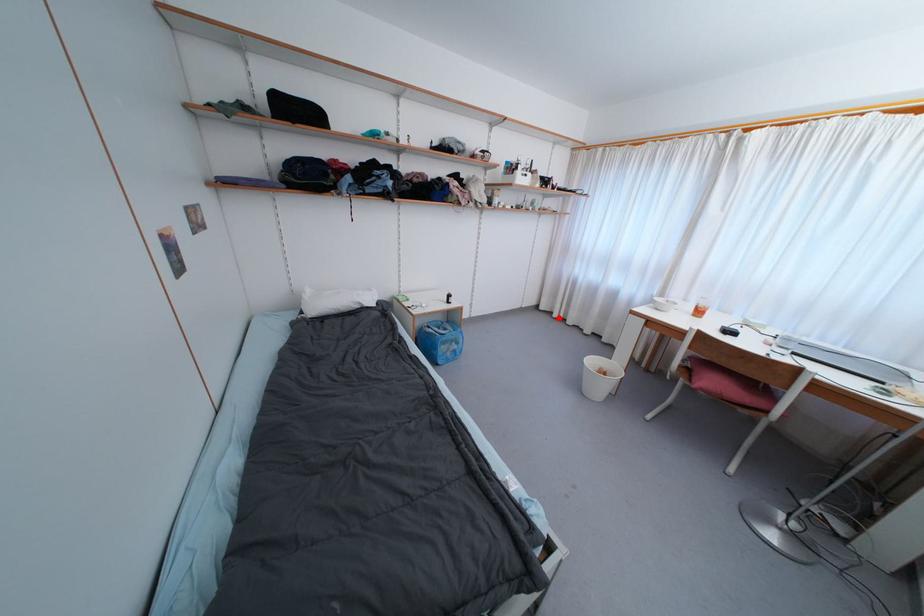
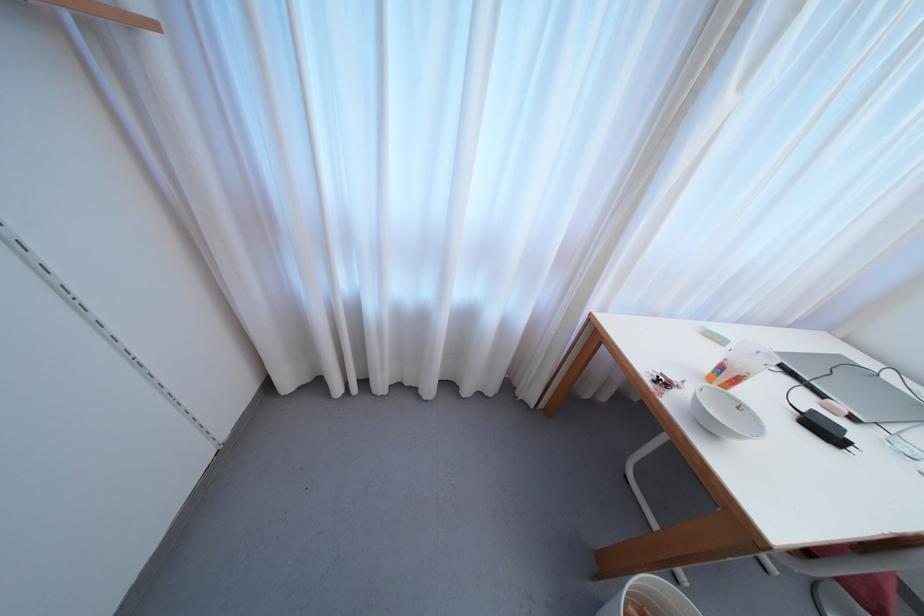
Question: I am providing you with two images of the same scene from different viewpoints. Given a red point in image1, look at the same physical point in image2. Is it:

Choices:
 (A) Closer to the viewpoint
 (B) Farther from the viewpoint

Answer: (B)